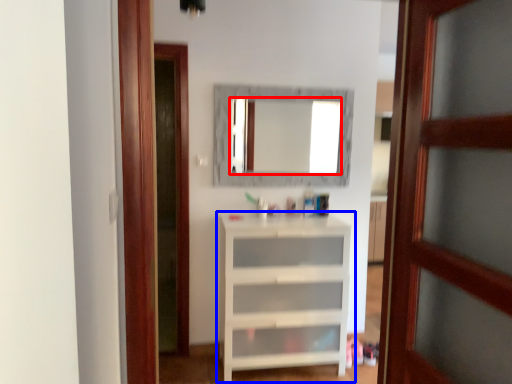
Question: Which object is closer to the camera taking this photo, mirror (highlighted by a red box) or shelf (highlighted by a blue box)?

Choices:
 (A) mirror
 (B) shelf

Answer: (B)